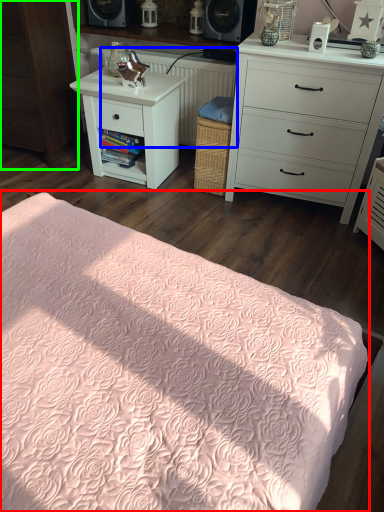
Question: Which is nearer to the bed (highlighted by a red box)? radiator (highlighted by a blue box) or cabinetry (highlighted by a green box).

Choices:
 (A) radiator
 (B) cabinetry

Answer: (B)